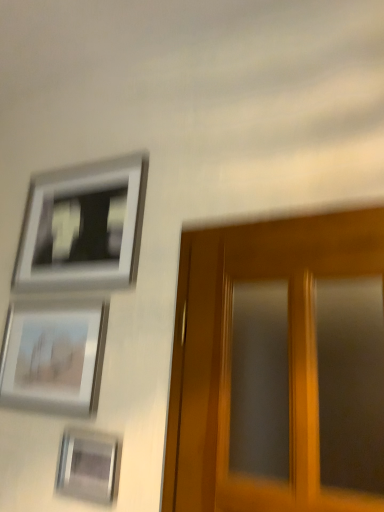
Where is `metallic silver picture frame at lower left, the 1th picture frame ordered from the bottom`? metallic silver picture frame at lower left, the 1th picture frame ordered from the bottom is located at coordinates (89, 466).

In order to face silver metallic picture frame at upper left, which is the third picture frame from bottom to top, should I rotate leftwards or rightwards?

Turn left approximately 15.093 degrees to face it.

Image resolution: width=384 pixels, height=512 pixels. Describe the element at coordinates (54, 357) in the screenshot. I see `matte silver picture frame at lower left, the 2th picture frame when ordered from top to bottom` at that location.

Find the location of a particular element. The height and width of the screenshot is (512, 384). metallic silver picture frame at lower left, positioned as the third picture frame in top-to-bottom order is located at coordinates (89, 466).

Could silver metallic picture frame at upper left, which is the first picture frame from top to bottom, be considered to be inside matte silver picture frame at lower left, the 2th picture frame when ordered from top to bottom?

No, silver metallic picture frame at upper left, which is the first picture frame from top to bottom, is not surrounded by matte silver picture frame at lower left, the 2th picture frame when ordered from top to bottom.

Who is more distant, matte silver picture frame at lower left, the 2th picture frame when ordered from bottom to top, or silver metallic picture frame at upper left, which is the third picture frame from bottom to top?

Positioned behind is silver metallic picture frame at upper left, which is the third picture frame from bottom to top.

Measure the distance between matte silver picture frame at lower left, the 2th picture frame when ordered from top to bottom, and silver metallic picture frame at upper left, which is the third picture frame from bottom to top.

The distance of matte silver picture frame at lower left, the 2th picture frame when ordered from top to bottom, from silver metallic picture frame at upper left, which is the third picture frame from bottom to top, is 9.54 inches.

This screenshot has width=384, height=512. Identify the location of the 1st picture frame below the silver metallic picture frame at upper left, which is the third picture frame from bottom to top (from the image's perspective). (54, 357).

From a real-world perspective, is matte silver picture frame at lower left, the 2th picture frame when ordered from top to bottom, above or below metallic silver picture frame at lower left, positioned as the third picture frame in top-to-bottom order?

matte silver picture frame at lower left, the 2th picture frame when ordered from top to bottom, is situated higher than metallic silver picture frame at lower left, positioned as the third picture frame in top-to-bottom order, in the real world.

From the image's perspective, which is below, matte silver picture frame at lower left, the 2th picture frame when ordered from top to bottom, or metallic silver picture frame at lower left, positioned as the third picture frame in top-to-bottom order?

metallic silver picture frame at lower left, positioned as the third picture frame in top-to-bottom order, is shown below in the image.

Does point (103, 309) come closer to viewer compared to point (97, 440)?

No, it is not.

Does matte silver picture frame at lower left, the 2th picture frame when ordered from top to bottom, have a lesser height compared to metallic silver picture frame at lower left, positioned as the third picture frame in top-to-bottom order?

No, matte silver picture frame at lower left, the 2th picture frame when ordered from top to bottom, is not shorter than metallic silver picture frame at lower left, positioned as the third picture frame in top-to-bottom order.

Between point (26, 204) and point (65, 486), which one is positioned behind?

The point (26, 204) is farther.

Can we say silver metallic picture frame at upper left, which is the third picture frame from bottom to top, lies outside metallic silver picture frame at lower left, the 1th picture frame ordered from the bottom?

Yes, silver metallic picture frame at upper left, which is the third picture frame from bottom to top, is not within metallic silver picture frame at lower left, the 1th picture frame ordered from the bottom.

Are silver metallic picture frame at upper left, which is the third picture frame from bottom to top, and metallic silver picture frame at lower left, the 1th picture frame ordered from the bottom, far apart?

No, silver metallic picture frame at upper left, which is the third picture frame from bottom to top, is not far away from metallic silver picture frame at lower left, the 1th picture frame ordered from the bottom.

Who is more distant, silver metallic picture frame at upper left, which is the first picture frame from top to bottom, or metallic silver picture frame at lower left, positioned as the third picture frame in top-to-bottom order?

silver metallic picture frame at upper left, which is the first picture frame from top to bottom, is behind.

Can you confirm if silver metallic picture frame at upper left, which is the first picture frame from top to bottom, is shorter than matte silver picture frame at lower left, the 2th picture frame when ordered from bottom to top?

Incorrect, the height of silver metallic picture frame at upper left, which is the first picture frame from top to bottom, does not fall short of that of matte silver picture frame at lower left, the 2th picture frame when ordered from bottom to top.

Is silver metallic picture frame at upper left, which is the third picture frame from bottom to top, inside the boundaries of matte silver picture frame at lower left, the 2th picture frame when ordered from bottom to top, or outside?

silver metallic picture frame at upper left, which is the third picture frame from bottom to top, is not enclosed by matte silver picture frame at lower left, the 2th picture frame when ordered from bottom to top.

Is silver metallic picture frame at upper left, which is the first picture frame from top to bottom, placed right next to matte silver picture frame at lower left, the 2th picture frame when ordered from top to bottom?

silver metallic picture frame at upper left, which is the first picture frame from top to bottom, and matte silver picture frame at lower left, the 2th picture frame when ordered from top to bottom, are not in contact.

Is metallic silver picture frame at lower left, the 1th picture frame ordered from the bottom, facing towards matte silver picture frame at lower left, the 2th picture frame when ordered from top to bottom?

No, metallic silver picture frame at lower left, the 1th picture frame ordered from the bottom, is not aimed at matte silver picture frame at lower left, the 2th picture frame when ordered from top to bottom.

Between metallic silver picture frame at lower left, the 1th picture frame ordered from the bottom, and matte silver picture frame at lower left, the 2th picture frame when ordered from top to bottom, which one has larger width?

matte silver picture frame at lower left, the 2th picture frame when ordered from top to bottom.

From the image's perspective, is metallic silver picture frame at lower left, positioned as the third picture frame in top-to-bottom order, positioned above or below matte silver picture frame at lower left, the 2th picture frame when ordered from bottom to top?

→ metallic silver picture frame at lower left, positioned as the third picture frame in top-to-bottom order, is below matte silver picture frame at lower left, the 2th picture frame when ordered from bottom to top.

At what (x,y) coordinates should I click in order to perform the action: click on the 1st picture frame positioned above the metallic silver picture frame at lower left, the 1th picture frame ordered from the bottom (from the image's perspective). Please return your answer as a coordinate pair (x, y). Looking at the image, I should click on (54, 357).

Is there a large distance between metallic silver picture frame at lower left, the 1th picture frame ordered from the bottom, and silver metallic picture frame at upper left, which is the first picture frame from top to bottom?

No, metallic silver picture frame at lower left, the 1th picture frame ordered from the bottom, is not far from silver metallic picture frame at upper left, which is the first picture frame from top to bottom.

From the image's perspective, is metallic silver picture frame at lower left, positioned as the third picture frame in top-to-bottom order, located above silver metallic picture frame at upper left, which is the third picture frame from bottom to top?

No, from the image's perspective, metallic silver picture frame at lower left, positioned as the third picture frame in top-to-bottom order, is not over silver metallic picture frame at upper left, which is the third picture frame from bottom to top.

Is metallic silver picture frame at lower left, the 1th picture frame ordered from the bottom, surrounding silver metallic picture frame at upper left, which is the third picture frame from bottom to top?

No, metallic silver picture frame at lower left, the 1th picture frame ordered from the bottom, does not contain silver metallic picture frame at upper left, which is the third picture frame from bottom to top.

Is metallic silver picture frame at lower left, the 1th picture frame ordered from the bottom, looking in the opposite direction of silver metallic picture frame at upper left, which is the first picture frame from top to bottom?

That's not correct — metallic silver picture frame at lower left, the 1th picture frame ordered from the bottom, is not looking away from silver metallic picture frame at upper left, which is the first picture frame from top to bottom.

Where is `picture frame above the matte silver picture frame at lower left, the 2th picture frame when ordered from bottom to top (from the image's perspective)`? picture frame above the matte silver picture frame at lower left, the 2th picture frame when ordered from bottom to top (from the image's perspective) is located at coordinates (83, 227).

This screenshot has width=384, height=512. What are the coordinates of `picture frame that appears below the matte silver picture frame at lower left, the 2th picture frame when ordered from bottom to top (from the image's perspective)` in the screenshot? It's located at (89, 466).

From the picture: When comparing their distances from silver metallic picture frame at upper left, which is the first picture frame from top to bottom, does metallic silver picture frame at lower left, the 1th picture frame ordered from the bottom, or matte silver picture frame at lower left, the 2th picture frame when ordered from bottom to top, seem closer?

matte silver picture frame at lower left, the 2th picture frame when ordered from bottom to top, lies closer to silver metallic picture frame at upper left, which is the first picture frame from top to bottom, than the other object.

From the image, which object appears to be nearer to metallic silver picture frame at lower left, the 1th picture frame ordered from the bottom, matte silver picture frame at lower left, the 2th picture frame when ordered from bottom to top, or silver metallic picture frame at upper left, which is the first picture frame from top to bottom?

Based on the image, matte silver picture frame at lower left, the 2th picture frame when ordered from bottom to top, appears to be nearer to metallic silver picture frame at lower left, the 1th picture frame ordered from the bottom.

Considering their positions, is metallic silver picture frame at lower left, the 1th picture frame ordered from the bottom, positioned closer to matte silver picture frame at lower left, the 2th picture frame when ordered from bottom to top, than silver metallic picture frame at upper left, which is the third picture frame from bottom to top?

The object closer to matte silver picture frame at lower left, the 2th picture frame when ordered from bottom to top, is metallic silver picture frame at lower left, the 1th picture frame ordered from the bottom.

Which object lies further to the anchor point metallic silver picture frame at lower left, positioned as the third picture frame in top-to-bottom order, silver metallic picture frame at upper left, which is the first picture frame from top to bottom, or matte silver picture frame at lower left, the 2th picture frame when ordered from top to bottom?

The object further to metallic silver picture frame at lower left, positioned as the third picture frame in top-to-bottom order, is silver metallic picture frame at upper left, which is the first picture frame from top to bottom.

When comparing their distances from matte silver picture frame at lower left, the 2th picture frame when ordered from top to bottom, does silver metallic picture frame at upper left, which is the third picture frame from bottom to top, or metallic silver picture frame at lower left, positioned as the third picture frame in top-to-bottom order, seem further?

silver metallic picture frame at upper left, which is the third picture frame from bottom to top.

Which object lies nearer to the anchor point silver metallic picture frame at upper left, which is the first picture frame from top to bottom, matte silver picture frame at lower left, the 2th picture frame when ordered from top to bottom, or metallic silver picture frame at lower left, positioned as the third picture frame in top-to-bottom order?

matte silver picture frame at lower left, the 2th picture frame when ordered from top to bottom.

This screenshot has height=512, width=384. In order to click on picture frame between silver metallic picture frame at upper left, which is the third picture frame from bottom to top, and metallic silver picture frame at lower left, positioned as the third picture frame in top-to-bottom order, in the up-down direction in this screenshot , I will do `click(54, 357)`.